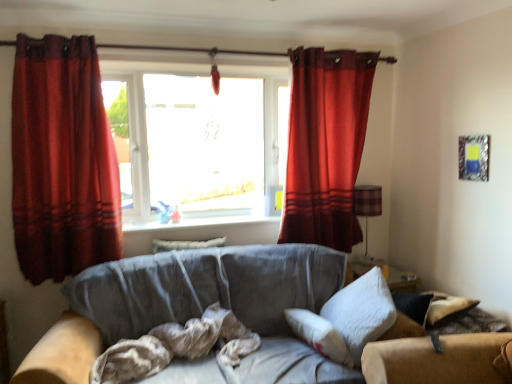
Question: Looking at their shapes, would you say velvet red curtain at upper right, the first curtain positioned from the right, is wider or thinner than metallic silver picture frame at upper right?

Choices:
 (A) thin
 (B) wide

Answer: (B)

Question: Is velvet red curtain at upper right, positioned as the first curtain in back-to-front order, bigger or smaller than metallic silver picture frame at upper right?

Choices:
 (A) big
 (B) small

Answer: (A)

Question: Which object is the closest to the plaid fabric lampshade at right?

Choices:
 (A) white fluffy pillow at right, placed as the first pillow when sorted from right to left
 (B) suede gray couch at center
 (C) brown textured fabric at center
 (D) velvet red curtain at upper right, positioned as the first curtain in back-to-front order
 (E) white glossy window sill at center

Answer: (D)

Question: Which object is the farthest from the suede gray couch at center?

Choices:
 (A) brown textured fabric at center
 (B) transparent glass window at center
 (C) white fluffy pillow at right, which appears as the first pillow when viewed from the front
 (D) white glossy window sill at center
 (E) velvet red curtain at left, the 1th curtain in the left-to-right sequence

Answer: (B)